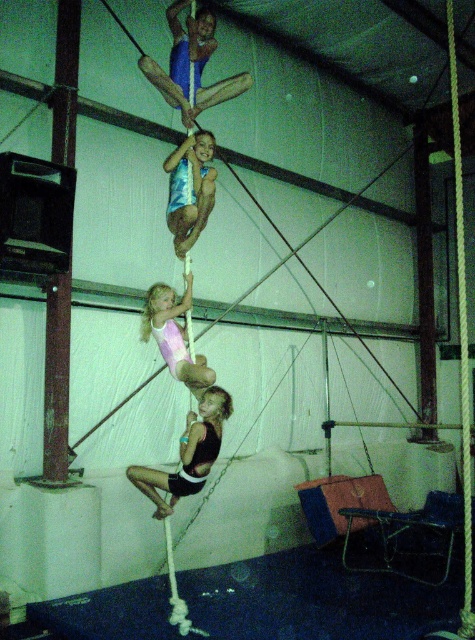
Who is more distant from viewer, (146, 477) or (167, 289)?

The point (167, 289) is more distant.

Can you confirm if black fabric shorts at center is thinner than pink leotard at center?

No.

The height and width of the screenshot is (640, 475). Describe the element at coordinates (188, 452) in the screenshot. I see `black fabric shorts at center` at that location.

Where is `black fabric shorts at center`? black fabric shorts at center is located at coordinates (188, 452).

The width and height of the screenshot is (475, 640). What do you see at coordinates (188, 452) in the screenshot?
I see `black fabric shorts at center` at bounding box center [188, 452].

Can you confirm if black fabric shorts at center is taller than shiny blue leotard at center?

No, black fabric shorts at center is not taller than shiny blue leotard at center.

Image resolution: width=475 pixels, height=640 pixels. In order to click on black fabric shorts at center in this screenshot , I will do `click(188, 452)`.

Is the position of shiny blue leotard at center less distant than that of pink leotard at center?

No, shiny blue leotard at center is further to the viewer.

Between shiny blue leotard at center and pink leotard at center, which one is positioned higher?

Positioned higher is shiny blue leotard at center.

Locate an element on the screen. Image resolution: width=475 pixels, height=640 pixels. shiny blue leotard at center is located at coordinates click(191, 189).